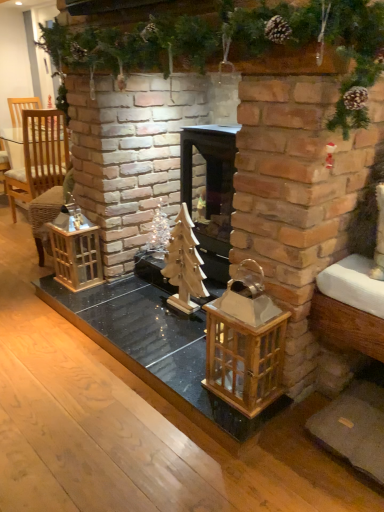
Question: Are wooden lantern at center, the 2th cage in the back-to-front sequence, and black wood fireplace at center far apart?

Choices:
 (A) yes
 (B) no

Answer: (B)

Question: Can we say wooden lantern at center, which ranks as the first cage in front-to-back order, lies outside black wood fireplace at center?

Choices:
 (A) no
 (B) yes

Answer: (B)

Question: Is wooden lantern at center, which ranks as the first cage in front-to-back order, thinner than black wood fireplace at center?

Choices:
 (A) no
 (B) yes

Answer: (B)

Question: Is wooden lantern at center, the second cage viewed from the left, facing away from black wood fireplace at center?

Choices:
 (A) yes
 (B) no

Answer: (B)

Question: From the image's perspective, is wooden lantern at center, which ranks as the 1th cage in right-to-left order, below black wood fireplace at center?

Choices:
 (A) no
 (B) yes

Answer: (B)

Question: Considering the relative positions of wooden lantern at center, the second cage viewed from the left, and black wood fireplace at center in the image provided, is wooden lantern at center, the second cage viewed from the left, to the right of black wood fireplace at center from the viewer's perspective?

Choices:
 (A) no
 (B) yes

Answer: (A)

Question: Can you confirm if wooden lantern at center, the second cage viewed from the left, is positioned to the right of wooden christmas tree at center?

Choices:
 (A) no
 (B) yes

Answer: (B)

Question: Is wooden lantern at center, which ranks as the first cage in front-to-back order, positioned with its back to wooden christmas tree at center?

Choices:
 (A) no
 (B) yes

Answer: (A)

Question: Does wooden lantern at center, which ranks as the 1th cage in right-to-left order, touch wooden christmas tree at center?

Choices:
 (A) yes
 (B) no

Answer: (B)

Question: Is there a large distance between wooden lantern at center, the second cage viewed from the left, and wooden christmas tree at center?

Choices:
 (A) yes
 (B) no

Answer: (B)

Question: Can you confirm if wooden lantern at center, which ranks as the first cage in front-to-back order, is taller than wooden christmas tree at center?

Choices:
 (A) yes
 (B) no

Answer: (B)

Question: Would you say wooden lantern at center, the 2th cage in the back-to-front sequence, is outside wooden christmas tree at center?

Choices:
 (A) no
 (B) yes

Answer: (B)

Question: Is wooden lantern at left, which appears as the 2th cage when viewed from the front, facing away from woven wicker armchair at left?

Choices:
 (A) no
 (B) yes

Answer: (A)